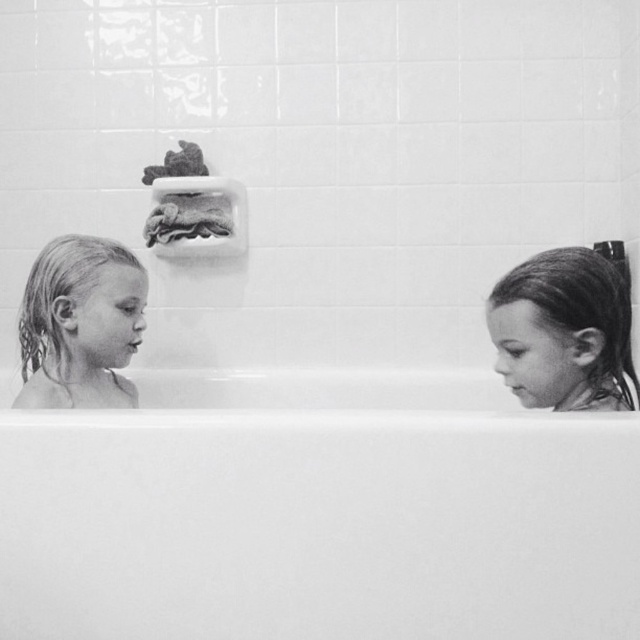
Consider the image. You are a photographer trying to capture a closeup shot of the child at point (566, 323) and the child at point (83, 336) in the bathtub. Which child will appear larger in the photo?

The child at point (566, 323) will appear larger because it is closer to the camera than the child at point (83, 336).

You are a photographer analyzing the composition of this black and white photo. The white smooth bathtub at center and the wet blonde hair at left are two key elements. Based on their sizes in the image, which object appears larger?

The wet blonde hair at left appears larger than the white smooth bathtub at center in the image.

Looking at the bathtub scene, which child has their hair color visible? The children are the wet hair at right and the wet blonde hair at left.

The wet blonde hair at left has visible hair color, while the wet hair at right does not specify a color.